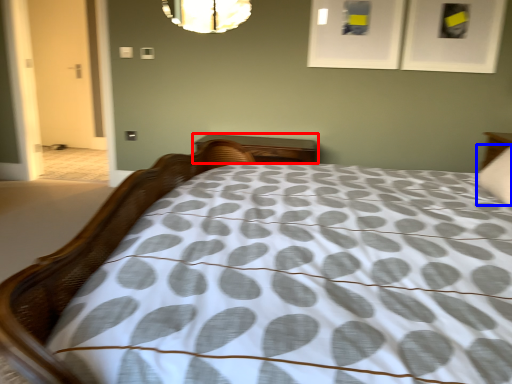
Question: Which point is closer to the camera, nightstand (highlighted by a red box) or pillow (highlighted by a blue box)?

Choices:
 (A) nightstand
 (B) pillow

Answer: (B)